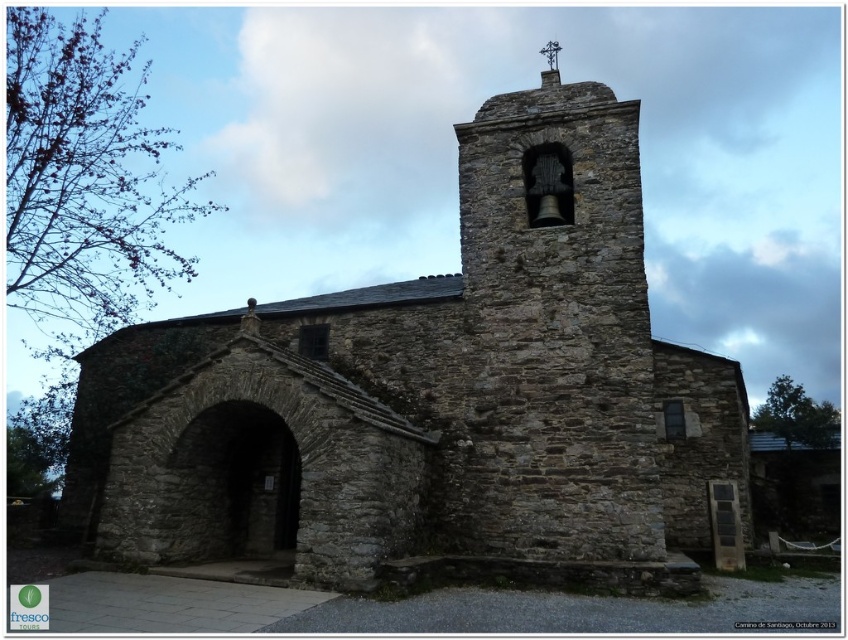
You are standing at point A located at coordinates (433, 396) in the image. What structure can you see directly in front of you?

The rustic stone church at center is located directly in front of you at point A.

You are standing in front of the rustic stone church at center and want to walk towards the rustic stone bell tower at center. In which direction should you move?

The rustic stone church at center is to the left of rustic stone bell tower at center, so you should move to the right to reach the bell tower.